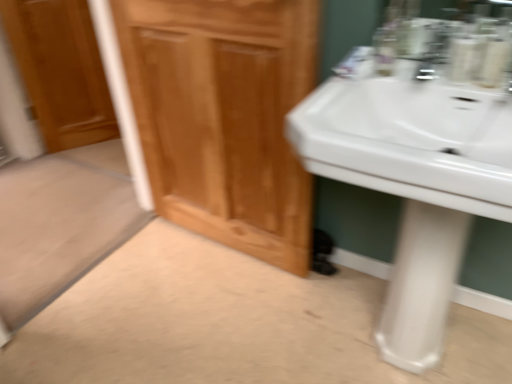
Question: Is wooden cabinet at center spatially inside wooden door at left, or outside of it?

Choices:
 (A) inside
 (B) outside

Answer: (B)

Question: Considering the positions of point (142, 153) and point (56, 28), is point (142, 153) closer or farther from the camera than point (56, 28)?

Choices:
 (A) closer
 (B) farther

Answer: (A)

Question: Considering the real-world distances, which object is farthest from the wooden cabinet at center?

Choices:
 (A) white glossy pedestal at lower right
 (B) white glossy sink at right
 (C) wooden door at left

Answer: (C)

Question: Which of these objects is positioned farthest from the white glossy pedestal at lower right?

Choices:
 (A) white glossy sink at right
 (B) wooden cabinet at center
 (C) wooden door at left

Answer: (C)